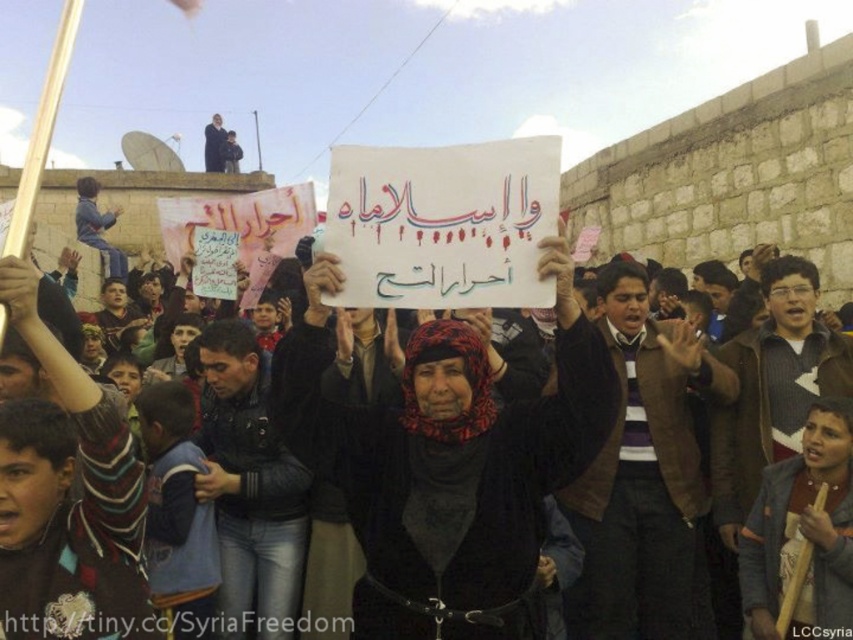
Looking at this image, who is positioned more to the right, black fabric headscarf at center or white paper sign at center?

white paper sign at center

Is black fabric headscarf at center wider than white paper sign at center?

In fact, black fabric headscarf at center might be narrower than white paper sign at center.

Is point (473, 465) farther from camera compared to point (427, 436)?

No, it is not.

Find the location of a particular element. black fabric headscarf at center is located at coordinates (445, 461).